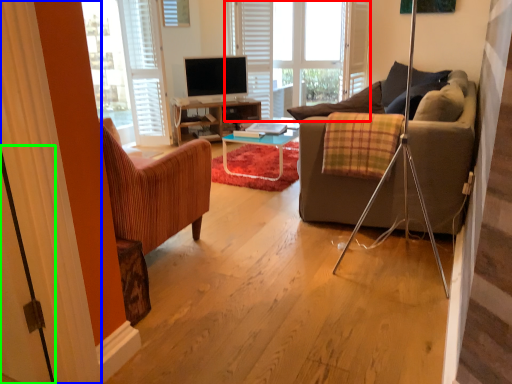
Question: Which is farther away from bay window (highlighted by a red box)? curtain (highlighted by a blue box) or screen door (highlighted by a green box)?

Choices:
 (A) curtain
 (B) screen door

Answer: (B)